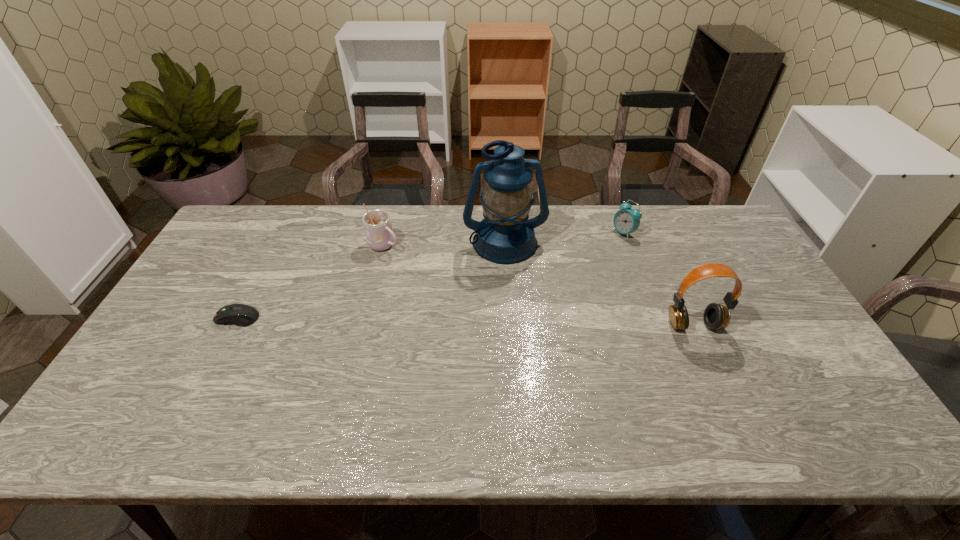
At what (x,y) coordinates should I click in order to perform the action: click on alarm clock at the far edge. Please return your answer as a coordinate pair (x, y). This screenshot has height=540, width=960. Looking at the image, I should click on (626, 220).

I want to click on cup present at the far edge, so click(377, 224).

Identify the location of lantern at the far edge. The image size is (960, 540). (505, 236).

Find the location of a particular element. This screenshot has height=540, width=960. object that is positioned at the left edge is located at coordinates (242, 315).

In the image, there is a desktop. Where is `vacant space at the far edge`? vacant space at the far edge is located at coordinates (438, 221).

This screenshot has height=540, width=960. I want to click on blank area at the near edge, so click(570, 386).

You are a GUI agent. You are given a task and a screenshot of the screen. Output one action in this format:
    pyautogui.click(x=<x>, y=<y>)
    Task: Click on the vacant space at the left edge of the desktop
    This screenshot has width=960, height=540.
    Given the screenshot: What is the action you would take?
    pyautogui.click(x=201, y=326)

Where is `vacant space at the right edge`? The image size is (960, 540). vacant space at the right edge is located at coordinates (765, 306).

Image resolution: width=960 pixels, height=540 pixels. I want to click on free region at the near left corner, so click(159, 394).

This screenshot has width=960, height=540. In order to click on empty space between the shortest object and the headset in this screenshot , I will do `click(466, 321)`.